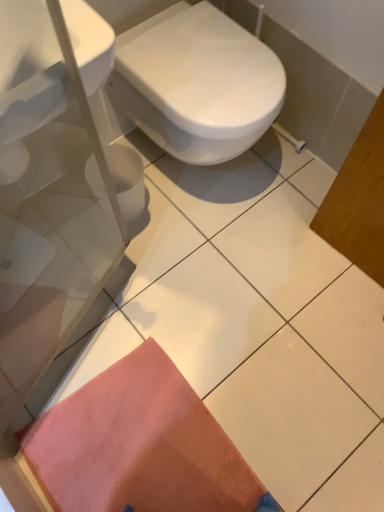
This screenshot has width=384, height=512. I want to click on orange textured mat at lower left, so [x=139, y=446].

At what (x,y) coordinates should I click in order to perform the action: click on doormat directly beneath the white glossy bidet at center (from a real-world perspective). Please return your answer as a coordinate pair (x, y). This screenshot has height=512, width=384. Looking at the image, I should click on (139, 446).

Considering the sizes of objects orange textured mat at lower left and white glossy bidet at center in the image provided, who is thinner, orange textured mat at lower left or white glossy bidet at center?

→ With smaller width is orange textured mat at lower left.

Would you say orange textured mat at lower left is to the left or to the right of white glossy bidet at center in the picture?

orange textured mat at lower left is to the left of white glossy bidet at center.

From the image's perspective, between white glossy sink at upper left and white glossy bidet at center, who is located below?

white glossy sink at upper left.

Is white glossy sink at upper left placed right next to white glossy bidet at center?

white glossy sink at upper left and white glossy bidet at center are clearly separated.

Could you tell me if white glossy sink at upper left is facing white glossy bidet at center?

No, white glossy sink at upper left is not facing towards white glossy bidet at center.

Considering the sizes of objects white glossy sink at upper left and white glossy bidet at center in the image provided, who is smaller, white glossy sink at upper left or white glossy bidet at center?

white glossy sink at upper left.

Between white glossy bidet at center and white glossy sink at upper left, which one is positioned behind?

white glossy bidet at center is behind.

Would you say white glossy bidet at center is a long distance from white glossy sink at upper left?

That's not correct — white glossy bidet at center is a little close to white glossy sink at upper left.

Measure the distance from white glossy bidet at center to white glossy sink at upper left.

They are 17.58 inches apart.

Can you confirm if white glossy bidet at center is taller than white glossy sink at upper left?

Yes.

Is orange textured mat at lower left in front of or behind white glossy sink at upper left in the image?

orange textured mat at lower left is behind white glossy sink at upper left.

Is orange textured mat at lower left at the left side of white glossy sink at upper left?

No, orange textured mat at lower left is not to the left of white glossy sink at upper left.

Would you say white glossy sink at upper left is part of orange textured mat at lower left's contents?

No, white glossy sink at upper left is not a part of orange textured mat at lower left.

Is white glossy bidet at center thinner than orange textured mat at lower left?

In fact, white glossy bidet at center might be wider than orange textured mat at lower left.

Is white glossy bidet at center aimed at orange textured mat at lower left?

No, white glossy bidet at center does not turn towards orange textured mat at lower left.

Is white glossy bidet at center in contact with orange textured mat at lower left?

white glossy bidet at center is not next to orange textured mat at lower left, and they're not touching.

How far apart are white glossy bidet at center and orange textured mat at lower left?

white glossy bidet at center is 34.70 inches from orange textured mat at lower left.

Which object is positioned more to the left, white glossy sink at upper left or orange textured mat at lower left?

white glossy sink at upper left.

Consider the image. Is white glossy sink at upper left taller or shorter than orange textured mat at lower left?

Considering their sizes, white glossy sink at upper left has more height than orange textured mat at lower left.

From the picture: How different are the orientations of white glossy sink at upper left and orange textured mat at lower left in degrees?

There is a 88.2-degree angle between the facing directions of white glossy sink at upper left and orange textured mat at lower left.

Considering the points (29, 24) and (72, 404), which point is behind, point (29, 24) or point (72, 404)?

Positioned behind is point (72, 404).

This screenshot has height=512, width=384. In the image, there is a white glossy bidet at center. Find the location of `doormat below it (from a real-world perspective)`. doormat below it (from a real-world perspective) is located at coordinates (139, 446).

The width and height of the screenshot is (384, 512). Identify the location of bidet located on the right of white glossy sink at upper left. (199, 85).

Considering their positions, is white glossy sink at upper left positioned closer to white glossy bidet at center than orange textured mat at lower left?

white glossy sink at upper left is positioned closer to the anchor white glossy bidet at center.

Considering their positions, is white glossy bidet at center positioned further to orange textured mat at lower left than white glossy sink at upper left?

Among the two, white glossy sink at upper left is located further to orange textured mat at lower left.

When comparing their distances from white glossy sink at upper left, does white glossy bidet at center or orange textured mat at lower left seem closer?

white glossy bidet at center.

From the image, which object appears to be nearer to white glossy sink at upper left, orange textured mat at lower left or white glossy bidet at center?

The object closer to white glossy sink at upper left is white glossy bidet at center.

Which object lies nearer to the anchor point orange textured mat at lower left, white glossy sink at upper left or white glossy bidet at center?

white glossy bidet at center lies closer to orange textured mat at lower left than the other object.

Consider the image. Which object lies further to the anchor point white glossy bidet at center, orange textured mat at lower left or white glossy sink at upper left?

orange textured mat at lower left.

Find the location of a particular element. The height and width of the screenshot is (512, 384). sink between white glossy bidet at center and orange textured mat at lower left from top to bottom is located at coordinates (29, 69).